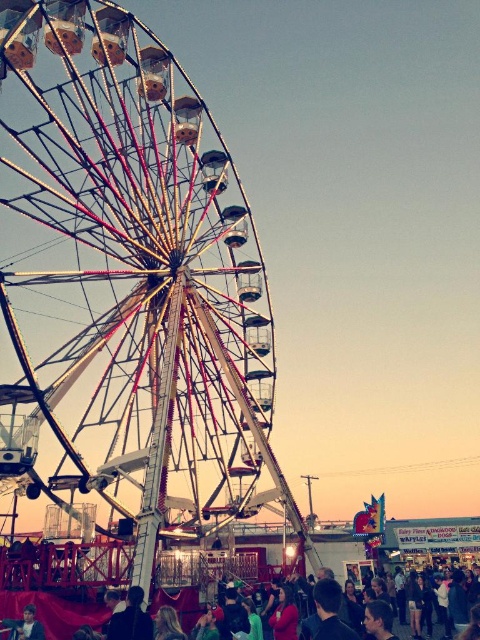
Is matte black crowd at lower center positioned in front of matte black jacket at lower left?

No, matte black crowd at lower center is behind matte black jacket at lower left.

Can you confirm if matte black crowd at lower center is positioned below matte black jacket at lower left?

Yes, matte black crowd at lower center is below matte black jacket at lower left.

Does point (66, 612) come behind point (19, 627)?

Yes.

Locate an element on the screen. The image size is (480, 640). matte black crowd at lower center is located at coordinates (52, 611).

Which is behind, point (71, 76) or point (135, 634)?

Positioned behind is point (71, 76).

Does metallic ferris wheel at left appear under matte black jacket at lower center?

No, metallic ferris wheel at left is not below matte black jacket at lower center.

Who is more distant from viewer, (48, 456) or (142, 628)?

Positioned behind is point (48, 456).

Where is `metallic ferris wheel at left`? The width and height of the screenshot is (480, 640). metallic ferris wheel at left is located at coordinates (126, 285).

Which of these two, metallic ferris wheel at left or matte black crowd at lower center, stands taller?

Standing taller between the two is metallic ferris wheel at left.

Where is `metallic ferris wheel at left`? This screenshot has height=640, width=480. metallic ferris wheel at left is located at coordinates (126, 285).

Between point (204, 115) and point (44, 593), which one is positioned in front?

Point (44, 593) is in front.

Locate an element on the screen. The height and width of the screenshot is (640, 480). metallic ferris wheel at left is located at coordinates (126, 285).